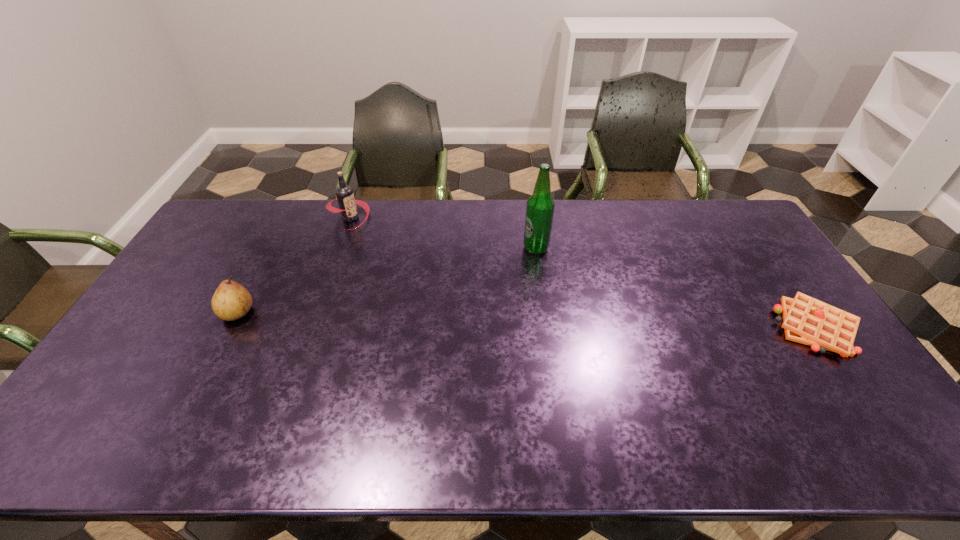
At what (x,y) coordinates should I click in order to perform the action: click on free spot on the desktop that is between the second shortest object and the rightmost object and is positioned on the label of the third object from right to left. Please return your answer as a coordinate pair (x, y). This screenshot has width=960, height=540. Looking at the image, I should click on (454, 319).

Identify the location of vacant space on the desktop that is between the second shortest object and the waffle and is positioned on the label of the tallest object. (487, 319).